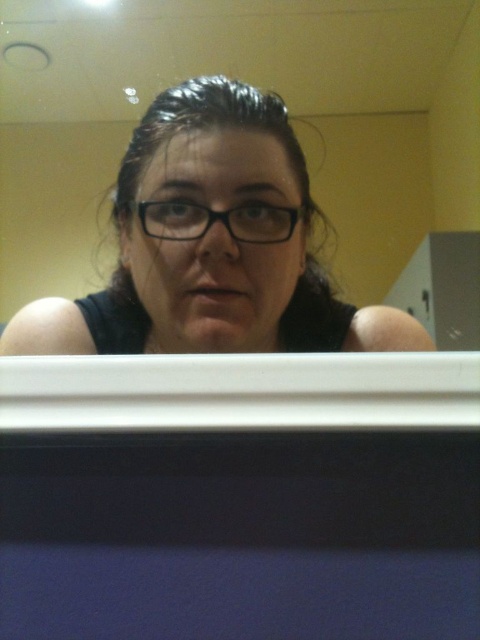
Question: Which object is closer to the camera taking this photo?

Choices:
 (A) black plastic glasses at center
 (B) matte black glasses at center

Answer: (B)

Question: Which point appears closest to the camera in this image?

Choices:
 (A) (288, 225)
 (B) (231, 228)

Answer: (B)

Question: Does matte black glasses at center have a lesser width compared to black plastic glasses at center?

Choices:
 (A) no
 (B) yes

Answer: (A)

Question: Observing the image, what is the correct spatial positioning of matte black glasses at center in reference to black plastic glasses at center?

Choices:
 (A) above
 (B) below

Answer: (B)

Question: Can you confirm if matte black glasses at center is smaller than black plastic glasses at center?

Choices:
 (A) yes
 (B) no

Answer: (B)